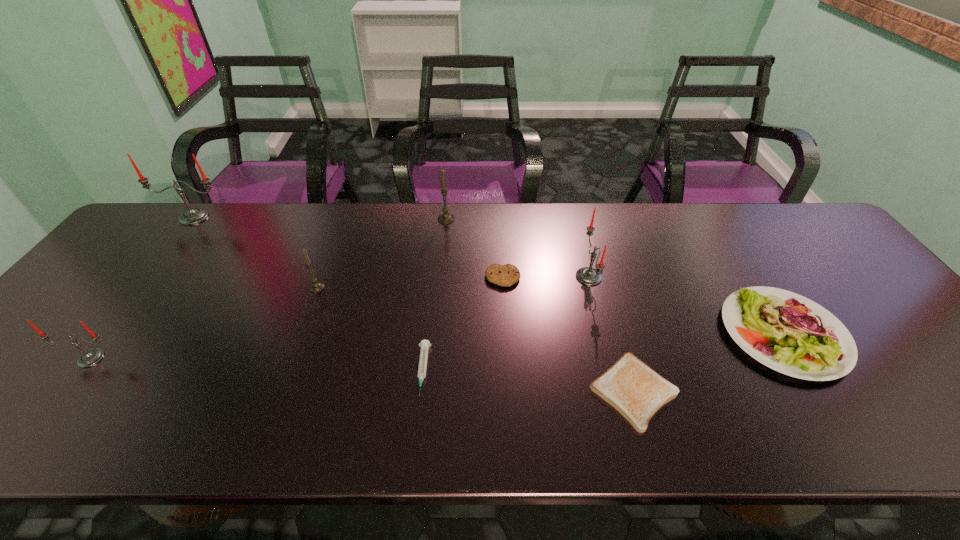
You are a GUI agent. You are given a task and a screenshot of the screen. Output one action in this format:
    pyautogui.click(x=<x>, y=<y>)
    Task: Click on the farthest red candle
    
    Given the screenshot: What is the action you would take?
    pyautogui.click(x=192, y=216)

I want to click on the biggest red candle, so click(192, 216).

This screenshot has height=540, width=960. In order to click on the rightmost red candle in this screenshot , I will do `click(589, 276)`.

At what (x,y) coordinates should I click in order to perform the action: click on the second biggest red candle. Please return your answer as a coordinate pair (x, y). The image size is (960, 540). Looking at the image, I should click on (589, 276).

Identify the location of the right gray candle. (445, 218).

You are a GUI agent. You are given a task and a screenshot of the screen. Output one action in this format:
    pyautogui.click(x=<x>, y=<y>)
    Task: Click on the farther gray candle
    This screenshot has width=960, height=540.
    Given the screenshot: What is the action you would take?
    445,218

Find the location of `the third candle from left to right`. the third candle from left to right is located at coordinates (316, 286).

You are a GUI agent. You are given a task and a screenshot of the screen. Output one action in this format:
    pyautogui.click(x=<x>, y=<y>)
    Task: Click on the smaller gray candle
    Image resolution: width=960 pixels, height=540 pixels.
    Given the screenshot: What is the action you would take?
    pyautogui.click(x=316, y=286)

Identify the location of the nearest red candle. The width and height of the screenshot is (960, 540). (89, 358).

Find the location of a particular element. Image resolution: width=960 pixels, height=540 pixels. the smallest red candle is located at coordinates click(x=89, y=358).